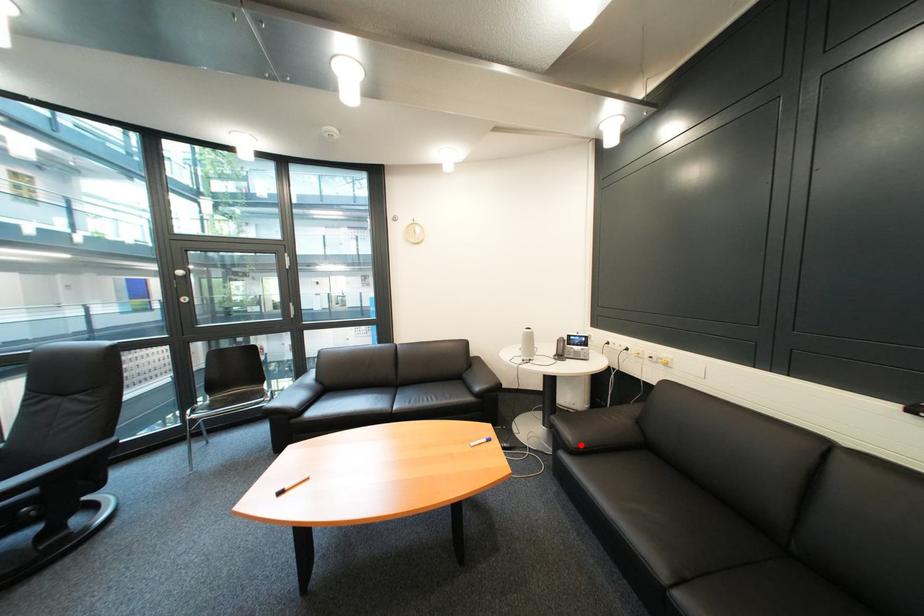
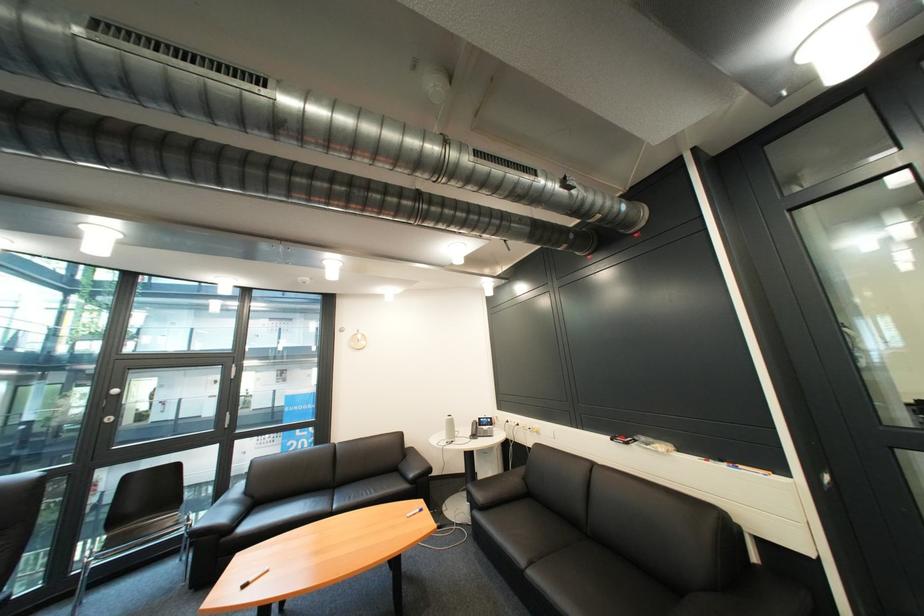
Question: I am providing you with two images of the same scene from different viewpoints. Given a red point in image1, look at the same physical point in image2. Is it:

Choices:
 (A) Closer to the viewpoint
 (B) Farther from the viewpoint

Answer: (A)